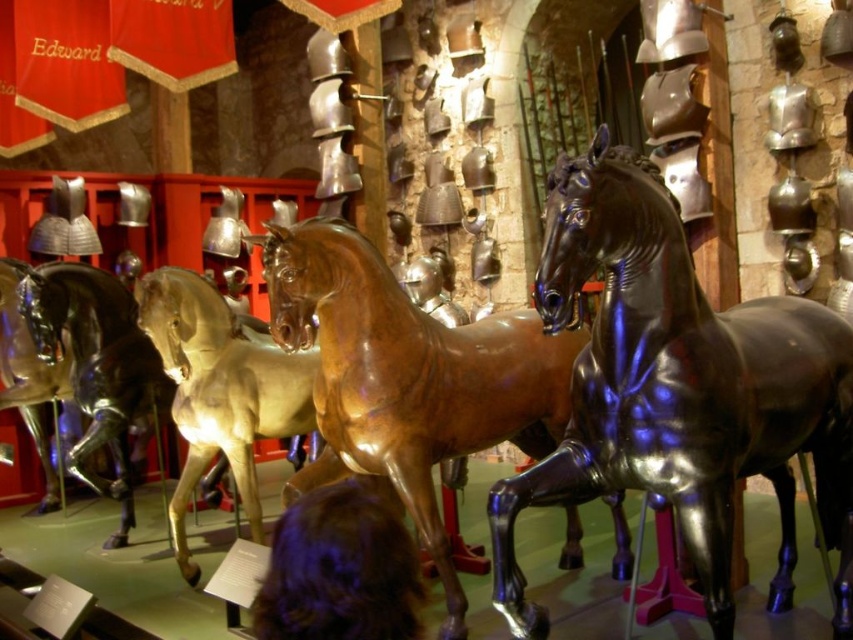
Is shiny bronze horse at center smaller than shiny gold horse at center?

Actually, shiny bronze horse at center might be larger than shiny gold horse at center.

Which is below, shiny bronze horse at center or shiny gold horse at center?

Positioned lower is shiny gold horse at center.

Is point (305, 282) closer to viewer compared to point (274, 410)?

Yes, it is.

Identify the location of shiny bronze horse at center. (408, 378).

Who is shorter, brown hair at lower center or glossy metallic horse at center?

brown hair at lower center

Can you confirm if brown hair at lower center is positioned below glossy metallic horse at center?

No, brown hair at lower center is not below glossy metallic horse at center.

Who is more forward, [338,609] or [97,381]?

Positioned in front is point [338,609].

Identify the location of brown hair at lower center. The height and width of the screenshot is (640, 853). (339, 570).

Can you confirm if glossy black horse at center is positioned to the left of glossy metallic horse at center?

In fact, glossy black horse at center is to the right of glossy metallic horse at center.

Is glossy black horse at center wider than glossy metallic horse at center?

Correct, the width of glossy black horse at center exceeds that of glossy metallic horse at center.

Who is more distant from viewer, (831, 518) or (80, 436)?

Positioned behind is point (80, 436).

Identify the location of glossy black horse at center. (677, 388).